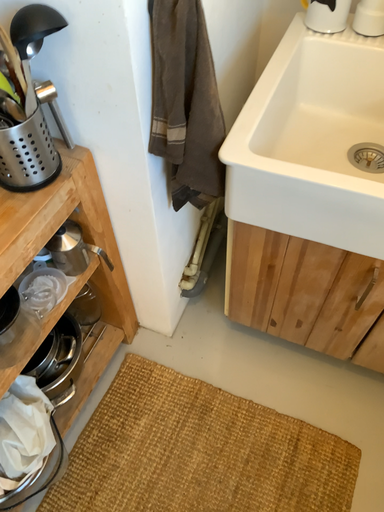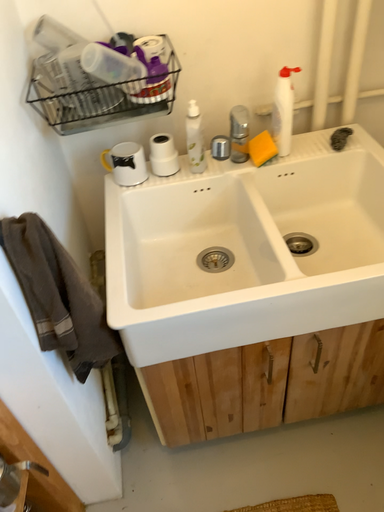
Question: How did the camera likely rotate when shooting the video?

Choices:
 (A) rotated left
 (B) rotated right

Answer: (B)